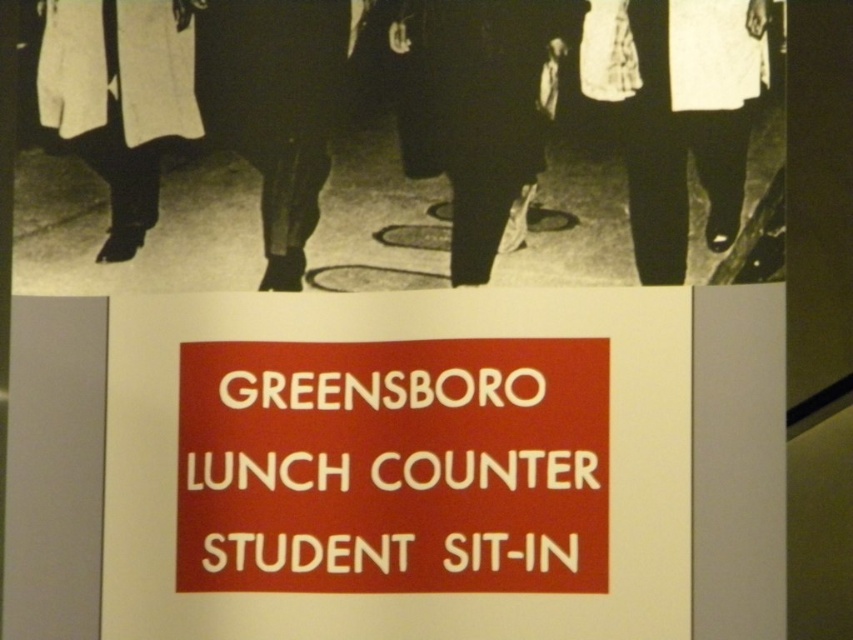
Question: Which object appears closest to the camera in this image?

Choices:
 (A) matte red sign at center
 (B) dark fabric pants at center
 (C) dark gray pants at center

Answer: (A)

Question: Is dark fabric pants at center thinner than matte black pants at center?

Choices:
 (A) no
 (B) yes

Answer: (A)

Question: Does matte red sign at center appear on the right side of matte white coat at left?

Choices:
 (A) no
 (B) yes

Answer: (B)

Question: Which object is closer to the camera taking this photo?

Choices:
 (A) dark gray pants at center
 (B) matte black pants at center
 (C) matte white coat at left

Answer: (A)

Question: Among these objects, which one is nearest to the camera?

Choices:
 (A) matte black pants at center
 (B) dark fabric pants at center
 (C) matte white coat at left

Answer: (C)

Question: Is matte red sign at center wider than dark gray pants at center?

Choices:
 (A) yes
 (B) no

Answer: (A)